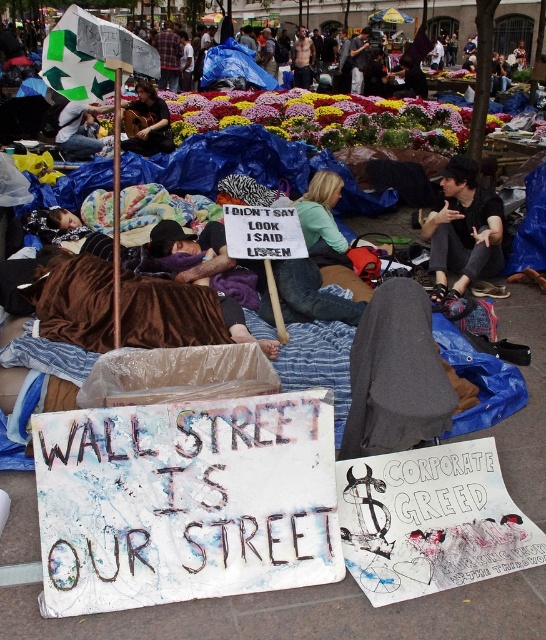
Who is more distant from viewer, (479,262) or (170,141)?

The point (170,141) is more distant.

Image resolution: width=546 pixels, height=640 pixels. Describe the element at coordinates (464, 230) in the screenshot. I see `black leather jacket at center` at that location.

Where is `black leather jacket at center`? Image resolution: width=546 pixels, height=640 pixels. black leather jacket at center is located at coordinates (464, 230).

Is point (437, 298) farther from viewer compared to point (305, 192)?

No.

Based on the photo, is black leather jacket at center smaller than green fabric shirt at center?

No, black leather jacket at center is not smaller than green fabric shirt at center.

Does point (443, 186) lie in front of point (324, 232)?

No, (443, 186) is behind (324, 232).

Where is `black leather jacket at center`? Image resolution: width=546 pixels, height=640 pixels. black leather jacket at center is located at coordinates (464, 230).

Between white cardboard sign at center and black leather jacket at center, which one has more height?

black leather jacket at center is taller.

Does point (250, 564) lie in front of point (450, 218)?

That is True.

Is point (281, 468) in front of point (495, 230)?

Yes, it is.

The width and height of the screenshot is (546, 640). In order to click on white cardboard sign at center in this screenshot , I will do `click(186, 500)`.